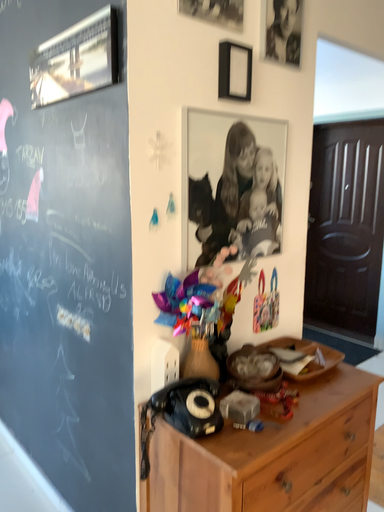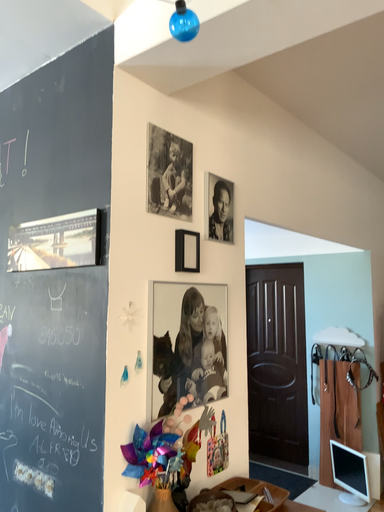
Question: How did the camera likely rotate when shooting the video?

Choices:
 (A) rotated downward
 (B) rotated upward

Answer: (B)